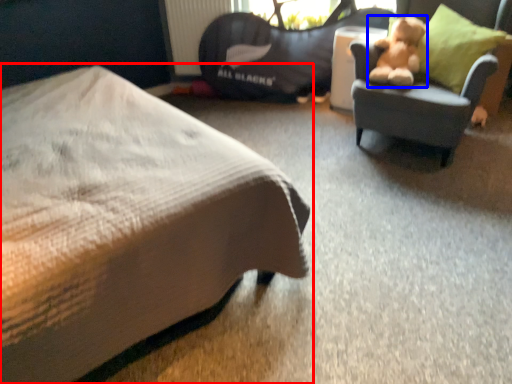
Question: Which point is closer to the camera, bed (highlighted by a red box) or teddy bear (highlighted by a blue box)?

Choices:
 (A) bed
 (B) teddy bear

Answer: (A)